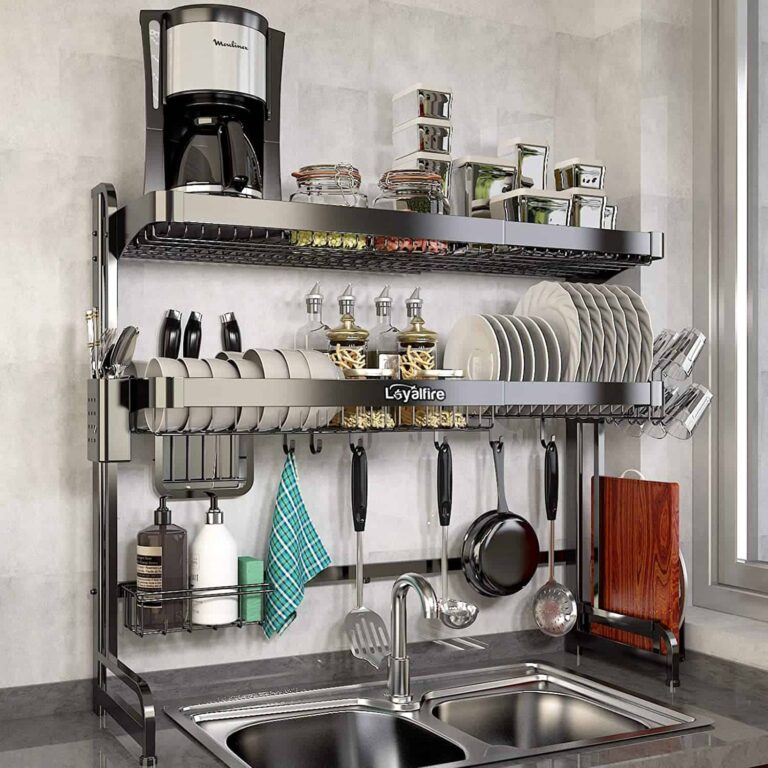
Identify the location of jar. The image size is (768, 768). (330, 199), (412, 204).